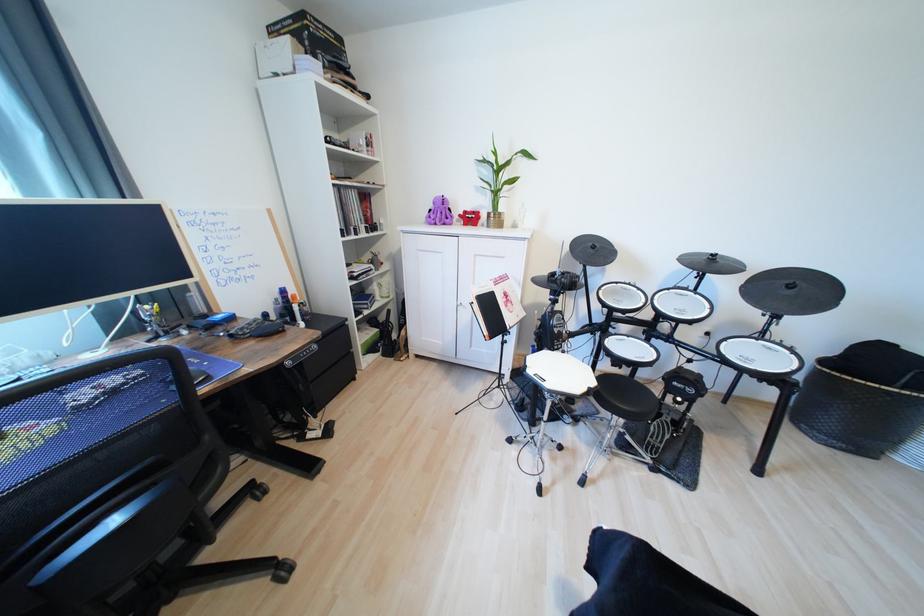
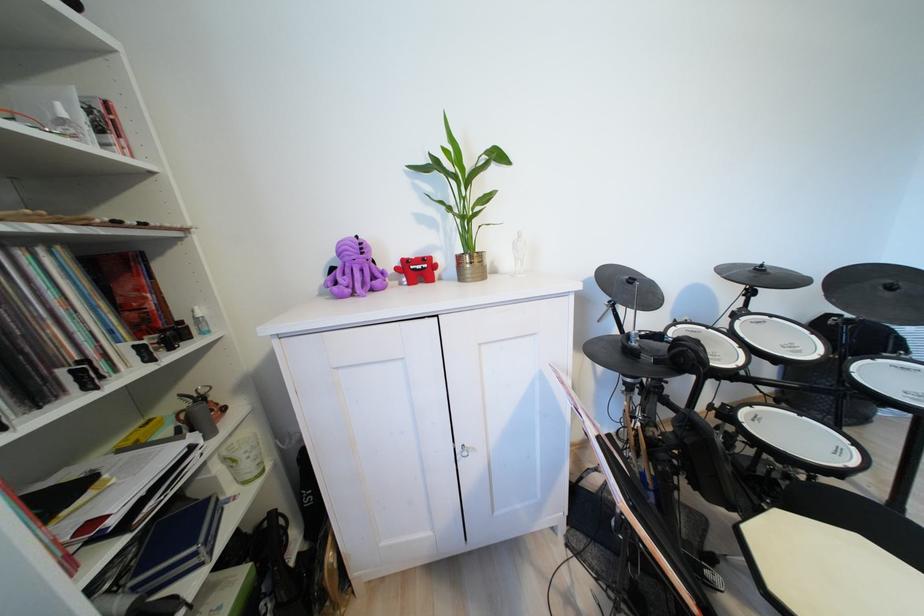
Find the pixel in the second image that matches pixel 385 220 in the first image.

(196, 310)